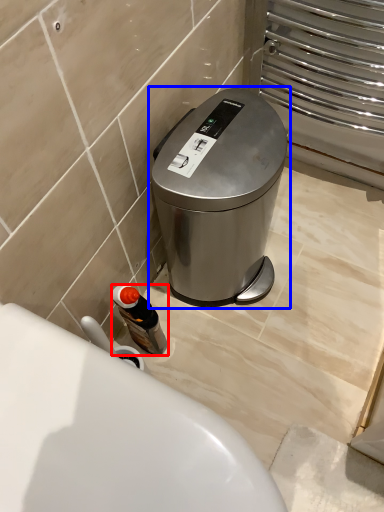
Question: Which point is closer to the camera, bottle (highlighted by a red box) or waste container (highlighted by a blue box)?

Choices:
 (A) bottle
 (B) waste container

Answer: (B)